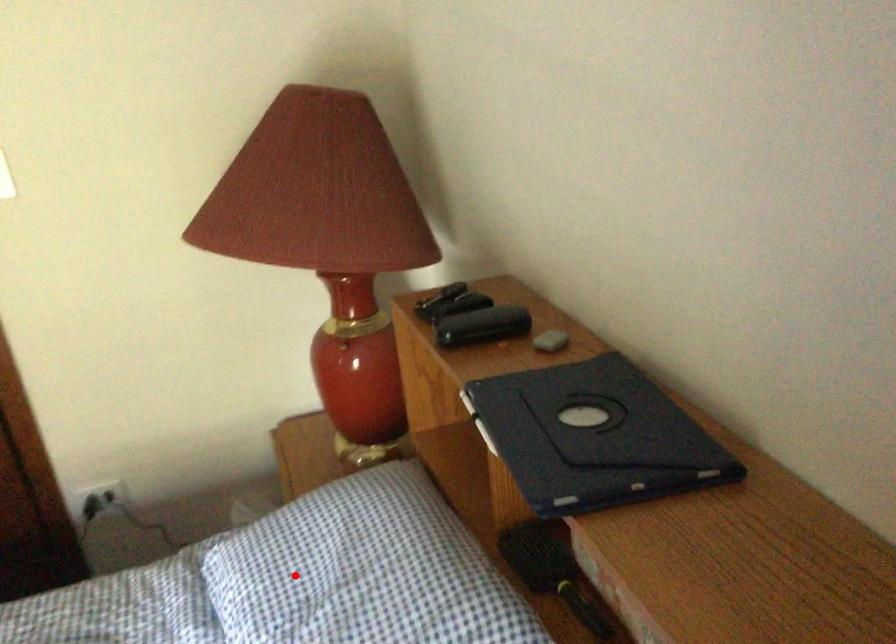
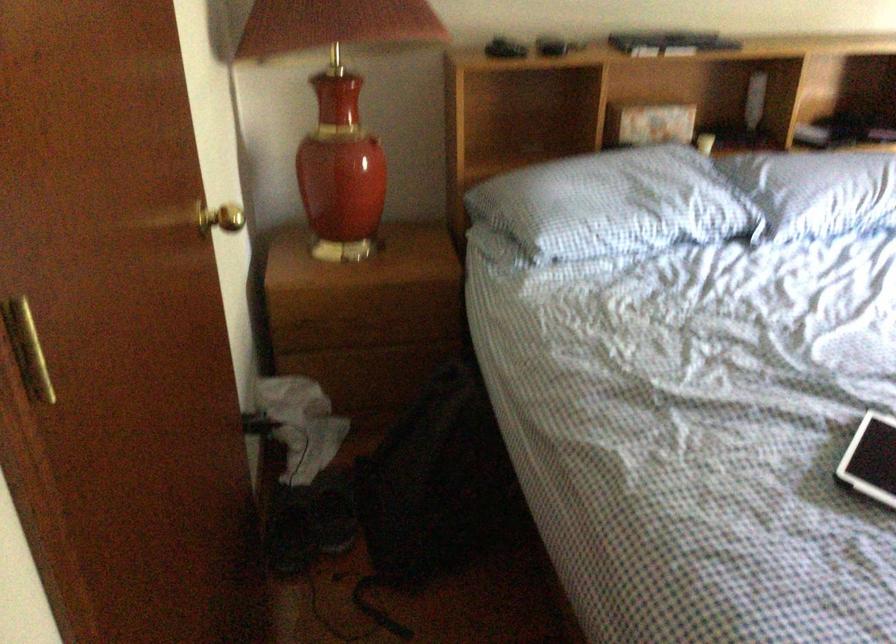
Question: I am providing you with two images of the same scene from different viewpoints. Image1 has a red point marked. In image2, the corresponding 3D location appears at what relative position? Reply with the corresponding letter.

Choices:
 (A) Closer
 (B) Farther

Answer: (B)